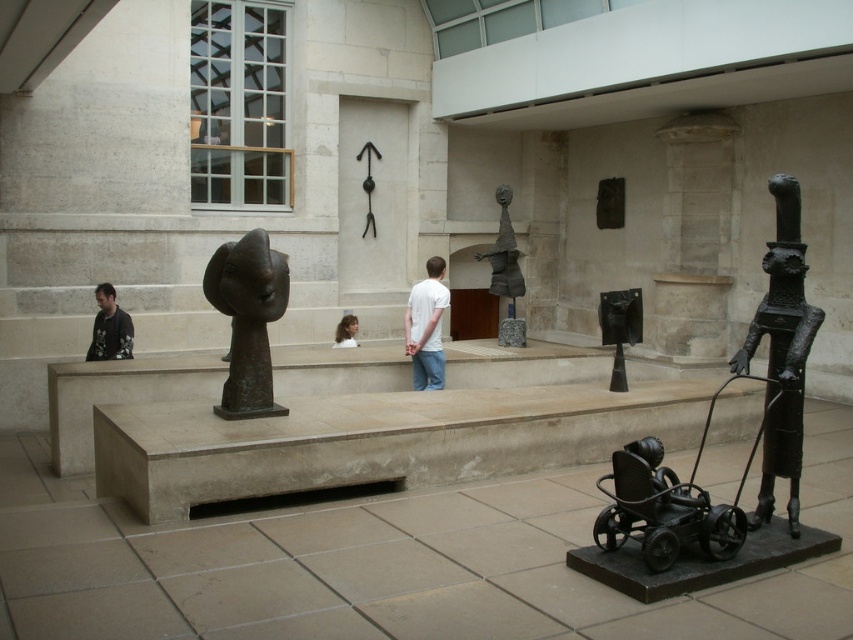
What is located at the coordinates point (782, 352)?

The black metal sculpture at right is located at point (782, 352).

You are standing in the museum looking at the sculptures. There are two points marked in the image, one at coordinates point (769,440) and another at point (495,284). Which point is closer to your viewpoint?

Point (769,440) is closer to the camera than point (495,284), so the point at coordinates point (769,440) is closer to your viewpoint.